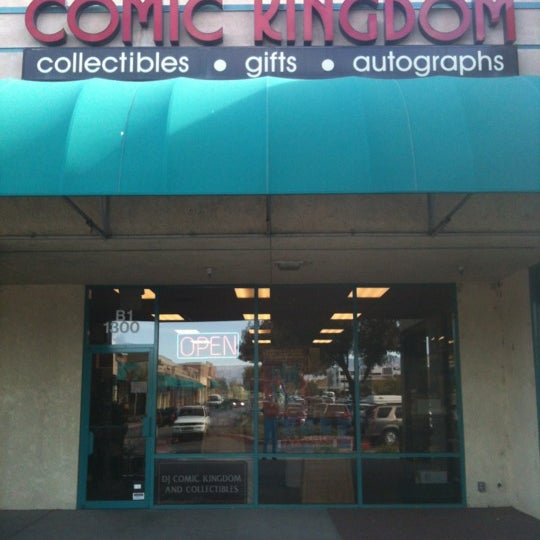
Find the location of a particular element. The height and width of the screenshot is (540, 540). door is located at coordinates (134, 402), (137, 445).